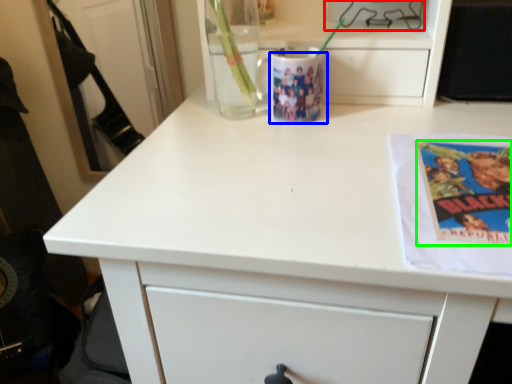
Question: Which object is positioned farthest from appliance (highlighted by a red box)? Select from mug (highlighted by a blue box) and paperback book (highlighted by a green box).

Choices:
 (A) mug
 (B) paperback book

Answer: (B)